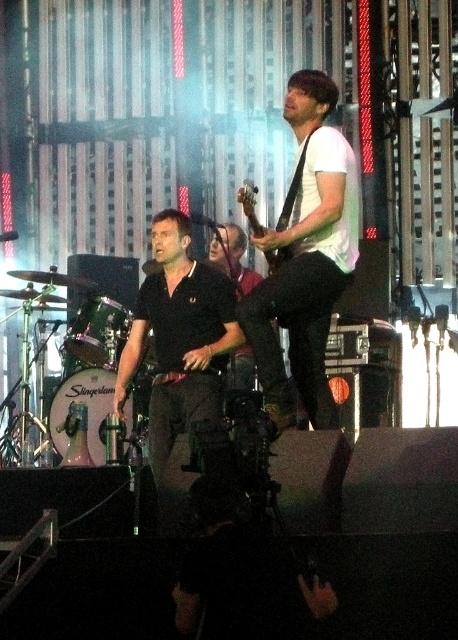
Based on the scene description, can you determine the relative positions of the white matte shirt at upper center and the black matte shirt at center? Specifically, which one is positioned to the right?

The white matte shirt at upper center is positioned to the right of the black matte shirt at center.

Based on the scene description, where is the white matte shirt at upper center located in terms of coordinates?

The white matte shirt at upper center is located at coordinates point [305,257].